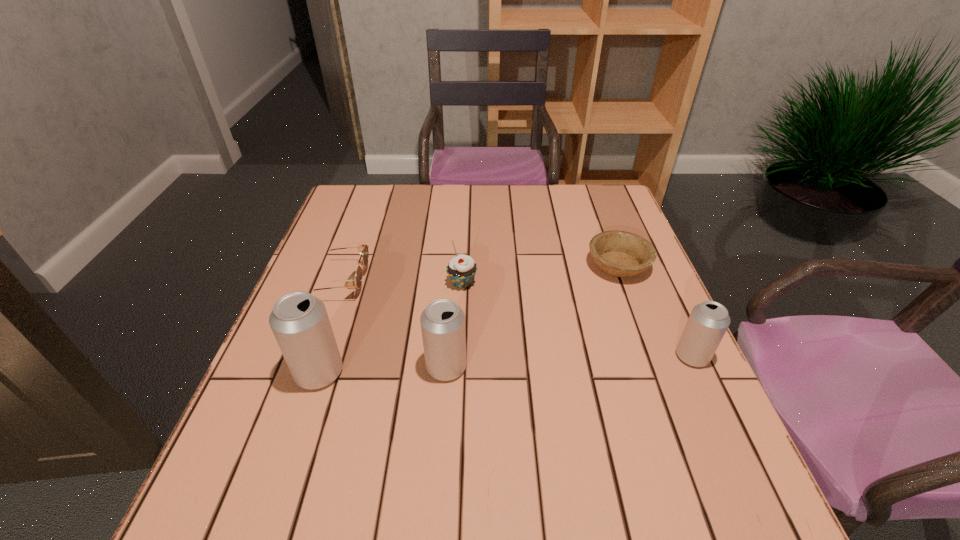
Locate an element on the screen. This screenshot has height=540, width=960. vacant space located on the left of the fourth shortest object is located at coordinates (506, 356).

Find the location of `vacant space positioned 0.250m on the front of the shortest object`. vacant space positioned 0.250m on the front of the shortest object is located at coordinates (657, 368).

Identify the location of free spot located on the front lenses of the fifth tallest object. (497, 281).

Identify the location of vacant space located 0.160m on the left of the cupcake. The width and height of the screenshot is (960, 540). (383, 283).

Where is `beer can located at the left edge`? The width and height of the screenshot is (960, 540). beer can located at the left edge is located at coordinates (299, 321).

You are a GUI agent. You are given a task and a screenshot of the screen. Output one action in this format:
    pyautogui.click(x=<x>, y=<y>)
    Task: Click on the sunglasses present at the left edge
    
    Given the screenshot: What is the action you would take?
    pyautogui.click(x=362, y=248)

The width and height of the screenshot is (960, 540). I want to click on beer can at the right edge, so click(x=708, y=322).

Locate an element on the screen. The width and height of the screenshot is (960, 540). bowl located in the right edge section of the desktop is located at coordinates (619, 253).

Identify the location of free space at the far edge of the desktop. The height and width of the screenshot is (540, 960). (489, 185).

Identify the location of vacant space at the left edge of the desktop. This screenshot has width=960, height=540. (339, 247).